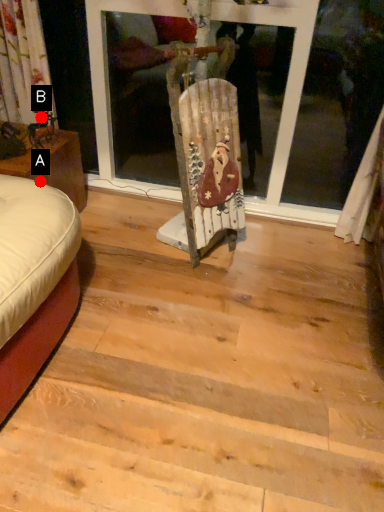
Question: Two points are circled on the image, labeled by A and B beside each circle. Which point is closer to the camera?

Choices:
 (A) A is closer
 (B) B is closer

Answer: (A)